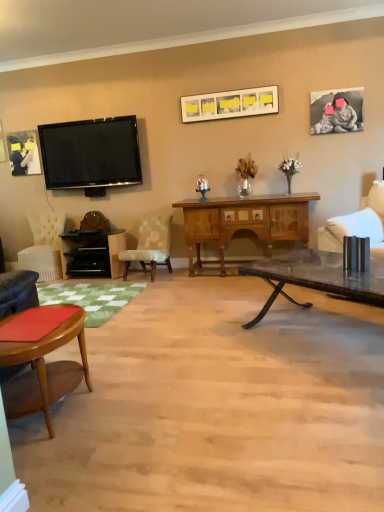
This screenshot has width=384, height=512. Identify the location of free spot in front of wooden cabinet at center. (229, 306).